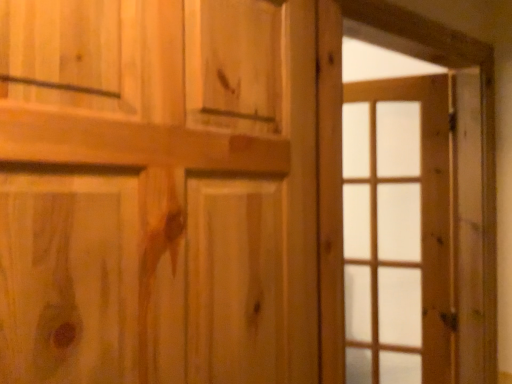
Question: Would you say wooden barn door at right is outside natural wood door at center?

Choices:
 (A) no
 (B) yes

Answer: (B)

Question: Can you confirm if wooden barn door at right is taller than natural wood door at center?

Choices:
 (A) yes
 (B) no

Answer: (A)

Question: From a real-world perspective, is wooden barn door at right physically above natural wood door at center?

Choices:
 (A) no
 (B) yes

Answer: (A)

Question: Is wooden barn door at right to the right of natural wood door at center from the viewer's perspective?

Choices:
 (A) no
 (B) yes

Answer: (B)

Question: Is wooden barn door at right oriented away from natural wood door at center?

Choices:
 (A) no
 (B) yes

Answer: (A)

Question: From a real-world perspective, is clear glass door at right positioned above or below natural wood door at center?

Choices:
 (A) above
 (B) below

Answer: (B)

Question: In the image, is clear glass door at right positioned in front of or behind natural wood door at center?

Choices:
 (A) behind
 (B) front

Answer: (A)

Question: Considering the positions of clear glass door at right and natural wood door at center in the image, is clear glass door at right wider or thinner than natural wood door at center?

Choices:
 (A) thin
 (B) wide

Answer: (A)

Question: Is point (356, 221) positioned closer to the camera than point (242, 120)?

Choices:
 (A) farther
 (B) closer

Answer: (A)

Question: Does point (397, 87) appear closer or farther from the camera than point (482, 115)?

Choices:
 (A) closer
 (B) farther

Answer: (B)

Question: From the image's perspective, is clear glass door at right located above or below wooden barn door at right?

Choices:
 (A) above
 (B) below

Answer: (B)

Question: In the image, is clear glass door at right positioned in front of or behind wooden barn door at right?

Choices:
 (A) behind
 (B) front

Answer: (A)

Question: Is clear glass door at right wider or thinner than wooden barn door at right?

Choices:
 (A) thin
 (B) wide

Answer: (B)

Question: Is natural wood door at center to the left or to the right of clear glass door at right in the image?

Choices:
 (A) right
 (B) left

Answer: (B)

Question: Considering the positions of natural wood door at center and clear glass door at right in the image, is natural wood door at center taller or shorter than clear glass door at right?

Choices:
 (A) short
 (B) tall

Answer: (A)